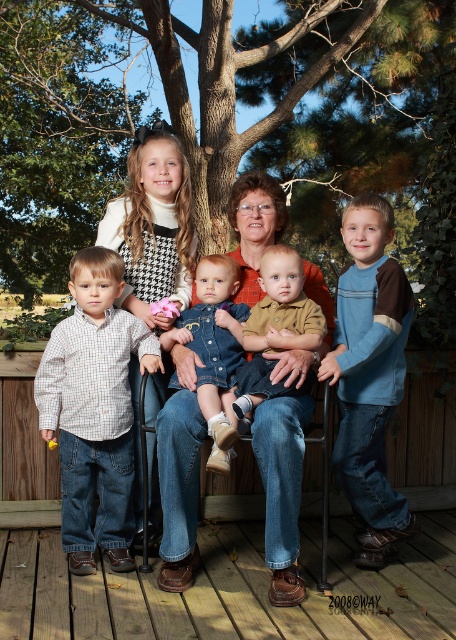
Is brown leather shoes at lower center shorter than checkered cotton shirt at left?

Indeed, brown leather shoes at lower center has a lesser height compared to checkered cotton shirt at left.

Who is positioned more to the left, brown leather shoes at lower center or checkered cotton shirt at left?

Positioned to the left is checkered cotton shirt at left.

Measure the distance between point (x=331, y=561) and camera.

Point (x=331, y=561) and camera are 3.84 meters apart.

Where is `brown leather shoes at lower center`? The width and height of the screenshot is (456, 640). brown leather shoes at lower center is located at coordinates 233,589.

Is brown leather shoes at lower center thinner than denim jacket at center?

In fact, brown leather shoes at lower center might be wider than denim jacket at center.

Who is lower down, brown leather shoes at lower center or denim jacket at center?

brown leather shoes at lower center is below.

Which is behind, point (104, 611) or point (206, 308)?

The point (206, 308) is behind.

This screenshot has width=456, height=640. What are the coordinates of `brown leather shoes at lower center` in the screenshot? It's located at (233, 589).

What are the coordinates of `green leafy tree at upper center` in the screenshot? It's located at (55, 136).

Does green leafy tree at upper center have a lesser width compared to brown denim shirt at center?

No, green leafy tree at upper center is not thinner than brown denim shirt at center.

Is point (452, 259) positioned behind point (259, 360)?

Yes, it is.

Where is `green leafy tree at upper center`? green leafy tree at upper center is located at coordinates (55, 136).